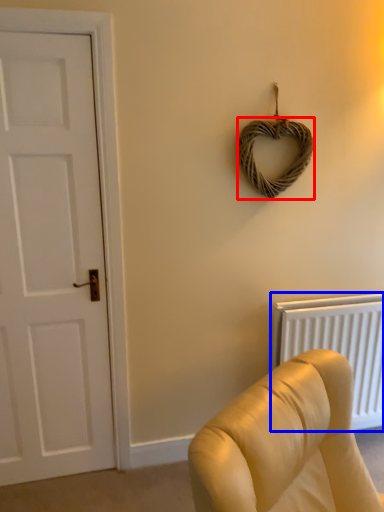
Question: Which object is closer to the camera taking this photo, rope (highlighted by a red box) or radiator (highlighted by a blue box)?

Choices:
 (A) rope
 (B) radiator

Answer: (A)